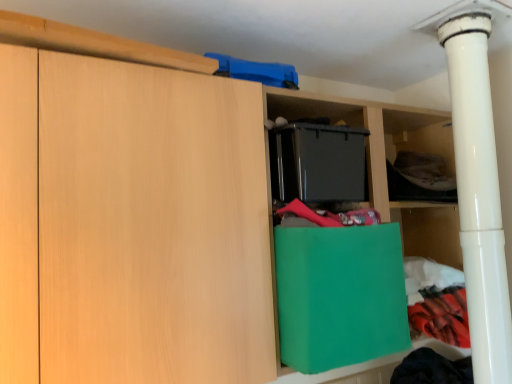
Question: From a real-world perspective, is dark gray fabric at upper right over white glossy pipe at right?

Choices:
 (A) yes
 (B) no

Answer: (A)

Question: Is dark gray fabric at upper right far from white glossy pipe at right?

Choices:
 (A) no
 (B) yes

Answer: (A)

Question: Could you tell me if dark gray fabric at upper right is turned towards white glossy pipe at right?

Choices:
 (A) no
 (B) yes

Answer: (B)

Question: From the image's perspective, is dark gray fabric at upper right beneath white glossy pipe at right?

Choices:
 (A) yes
 (B) no

Answer: (B)

Question: Is dark gray fabric at upper right bigger than white glossy pipe at right?

Choices:
 (A) yes
 (B) no

Answer: (B)

Question: In terms of size, does green paper bag at center appear bigger or smaller than dark gray fabric at upper right?

Choices:
 (A) big
 (B) small

Answer: (A)

Question: Is green paper bag at center in front of or behind dark gray fabric at upper right in the image?

Choices:
 (A) behind
 (B) front

Answer: (B)

Question: From the image's perspective, is green paper bag at center located above or below dark gray fabric at upper right?

Choices:
 (A) below
 (B) above

Answer: (A)

Question: Which is correct: green paper bag at center is inside dark gray fabric at upper right, or outside of it?

Choices:
 (A) outside
 (B) inside

Answer: (A)

Question: Looking at the image, does dark gray fabric at upper right seem bigger or smaller compared to green paper bag at center?

Choices:
 (A) small
 (B) big

Answer: (A)

Question: From their relative heights in the image, would you say dark gray fabric at upper right is taller or shorter than green paper bag at center?

Choices:
 (A) short
 (B) tall

Answer: (A)

Question: Is dark gray fabric at upper right in front of or behind green paper bag at center in the image?

Choices:
 (A) behind
 (B) front

Answer: (A)

Question: Is dark gray fabric at upper right spatially inside green paper bag at center, or outside of it?

Choices:
 (A) inside
 (B) outside

Answer: (B)

Question: From a real-world perspective, is white glossy pipe at right physically located above or below green paper bag at center?

Choices:
 (A) above
 (B) below

Answer: (A)

Question: Would you say white glossy pipe at right is to the left or to the right of green paper bag at center in the picture?

Choices:
 (A) right
 (B) left

Answer: (A)